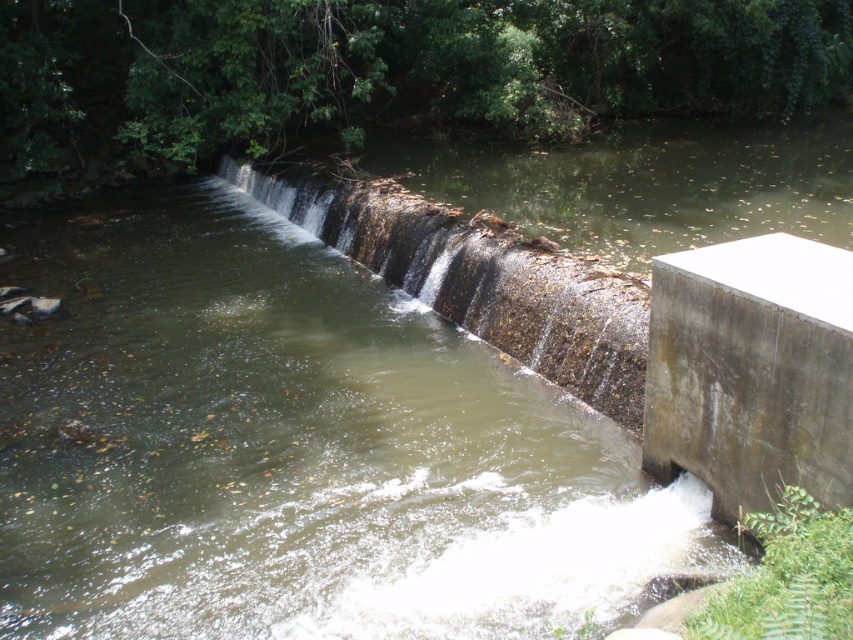
You are a construction worker assessing the dam structure. You need to determine which object, the gray concrete wall at lower right or the brown textured concrete waterfall at center, requires more immediate attention for maintenance based on their sizes. Which one should you prioritize?

The gray concrete wall at lower right has a smaller size compared to the brown textured concrete waterfall at center. Since smaller structures may be more vulnerable to damage, you should prioritize maintaining the gray concrete wall at lower right first.

You are a landscape architect designing a new pathway near the gray concrete wall at lower right and the brown textured concrete waterfall at center. Which object has a smaller width that you need to consider for the pathway design?

The gray concrete wall at lower right has a smaller width than the brown textured concrete waterfall at center, so you should consider its narrower dimension when designing the pathway.